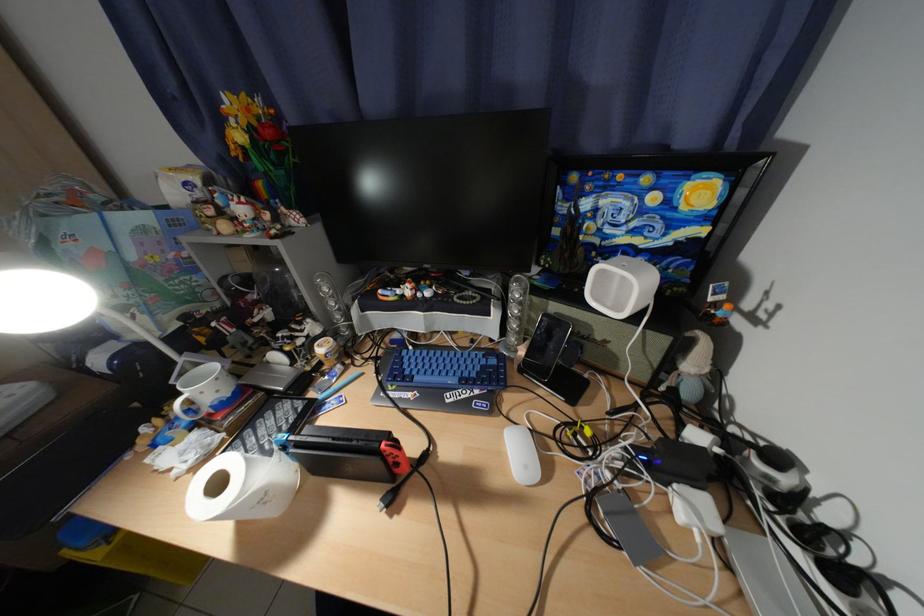
You are a GUI agent. You are given a task and a screenshot of the screen. Output one action in this format:
    pyautogui.click(x=<x>, y=<y>)
    Task: Click on the white computer mouse
    This screenshot has height=616, width=924.
    Given the screenshot: What is the action you would take?
    pyautogui.click(x=521, y=455)